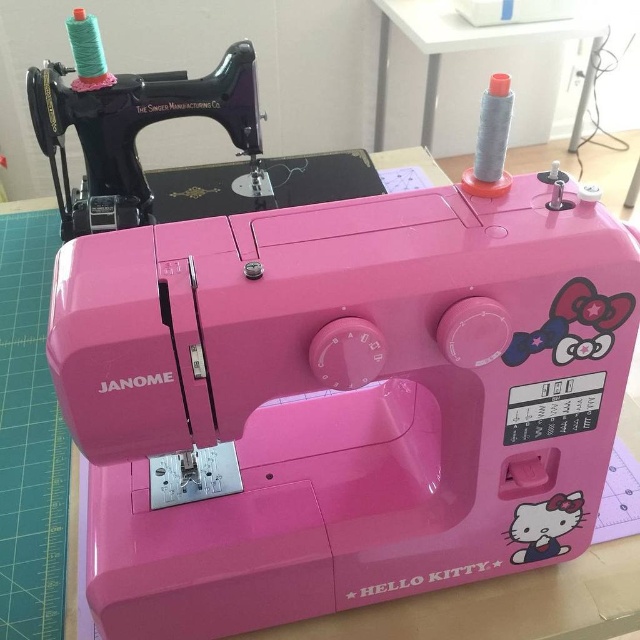
Is pink plastic sewing machine at upper left above gray fabric spool at upper right?

Actually, pink plastic sewing machine at upper left is below gray fabric spool at upper right.

Can you confirm if pink plastic sewing machine at upper left is positioned to the right of gray fabric spool at upper right?

Incorrect, pink plastic sewing machine at upper left is not on the right side of gray fabric spool at upper right.

In order to click on pink plastic sewing machine at upper left in this screenshot , I will do `click(166, 120)`.

Image resolution: width=640 pixels, height=640 pixels. What are the coordinates of `pink plastic sewing machine at upper left` in the screenshot? It's located at (166, 120).